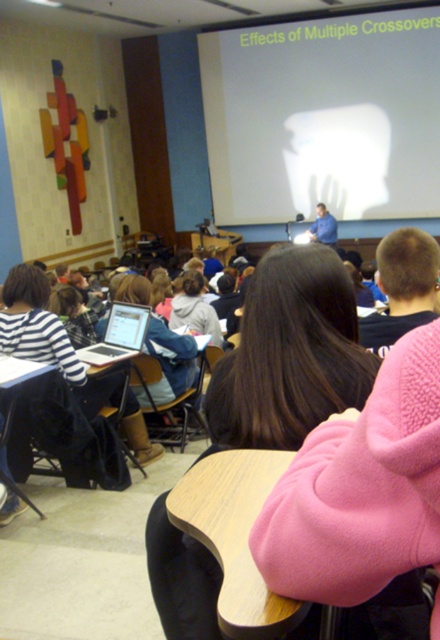
Is white matte projection screen at upper center further to the viewer compared to brown hair at center?

Yes, white matte projection screen at upper center is behind brown hair at center.

From the picture: Who is more forward, (261, 164) or (315, 396)?

Positioned in front is point (315, 396).

Who is more forward, (417, 48) or (176, 541)?

Point (176, 541) is more forward.

Where is `white matte projection screen at upper center`? Image resolution: width=440 pixels, height=640 pixels. white matte projection screen at upper center is located at coordinates (323, 116).

Who is positioned more to the left, brown hair at center or silver metallic laptop at center?

silver metallic laptop at center is more to the left.

Who is lower down, brown hair at center or silver metallic laptop at center?

Positioned lower is brown hair at center.

Does point (205, 595) come in front of point (124, 308)?

Yes, it is.

Image resolution: width=440 pixels, height=640 pixels. What are the coordinates of `brown hair at center` in the screenshot? It's located at (289, 355).

Can you confirm if white matte projection screen at upper center is positioned above silver metallic laptop at center?

Indeed, white matte projection screen at upper center is positioned over silver metallic laptop at center.

Between point (205, 70) and point (140, 314), which one is positioned behind?

Point (205, 70)

Between point (418, 154) and point (116, 317), which one is positioned behind?

Point (418, 154)

At what (x,y) coordinates should I click in order to perform the action: click on white matte projection screen at upper center. Please return your answer as a coordinate pair (x, y). The width and height of the screenshot is (440, 640). Looking at the image, I should click on pos(323,116).